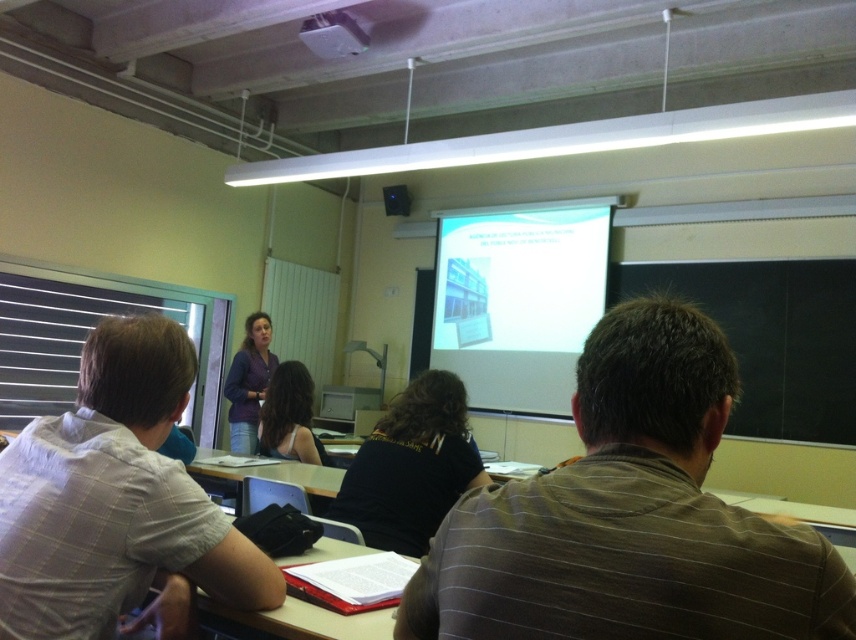
Question: Is red plastic folder at lower center positioned behind white plastic projector at upper center?

Choices:
 (A) yes
 (B) no

Answer: (B)

Question: Does gray striped shirt at left have a greater width compared to white plastic projector at upper center?

Choices:
 (A) no
 (B) yes

Answer: (B)

Question: Which point is farther from the camera taking this photo?

Choices:
 (A) (611, 634)
 (B) (364, 49)
 (C) (135, 369)

Answer: (B)

Question: Which object is the closest to the red plastic folder at lower center?

Choices:
 (A) white matte projection screen at upper center
 (B) blue fabric shirt at center
 (C) brown striped shirt at center

Answer: (C)

Question: Does white matte projection screen at upper center appear under red plastic folder at lower center?

Choices:
 (A) no
 (B) yes

Answer: (A)

Question: Which point appears farthest from the camera in this image?

Choices:
 (A) (645, 595)
 (B) (450, 221)
 (C) (241, 440)

Answer: (B)